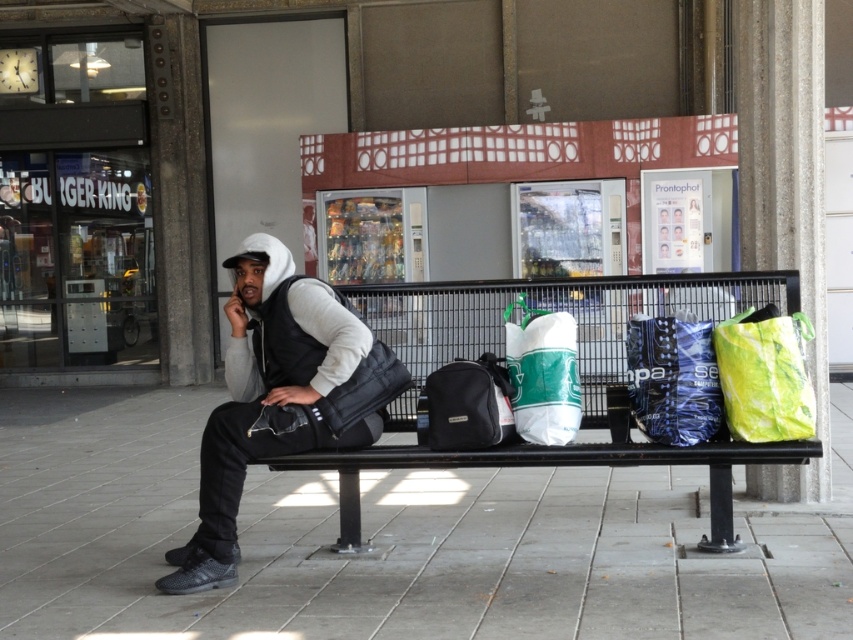
Can you confirm if black leather bench at center is taller than green matte shopping bag at center?

Indeed, black leather bench at center has a greater height compared to green matte shopping bag at center.

Who is taller, black leather bench at center or green matte shopping bag at center?

black leather bench at center is taller.

What do you see at coordinates (558, 465) in the screenshot?
I see `black leather bench at center` at bounding box center [558, 465].

The image size is (853, 640). What are the coordinates of `black leather bench at center` in the screenshot? It's located at (558, 465).

How far apart are green plastic bag at right and green matte shopping bag at center?

They are 74.15 centimeters apart.

Does green plastic bag at right come behind green matte shopping bag at center?

No, green plastic bag at right is closer to the viewer.

Who is more forward, [798,356] or [541,388]?

Point [798,356]

The height and width of the screenshot is (640, 853). Find the location of `green plastic bag at right`. green plastic bag at right is located at coordinates pyautogui.click(x=764, y=376).

In the scene shown: Is the position of black leather bench at center less distant than that of black fabric bag at center?

Yes, it is in front of black fabric bag at center.

Looking at this image, is black leather bench at center taller than black fabric bag at center?

Yes.

Is point (769, 458) farther from camera compared to point (456, 412)?

No, it is not.

The width and height of the screenshot is (853, 640). Identify the location of black leather bench at center. (558, 465).